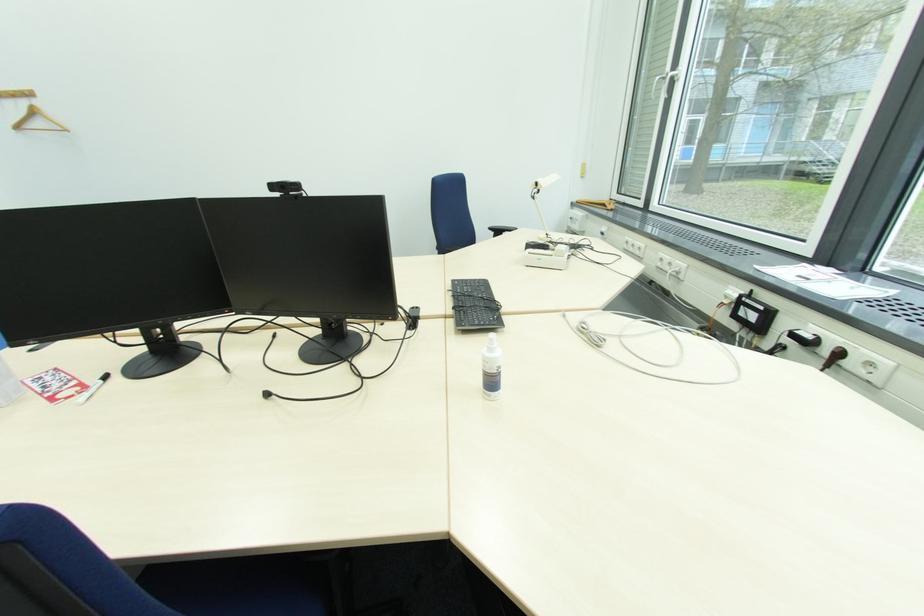
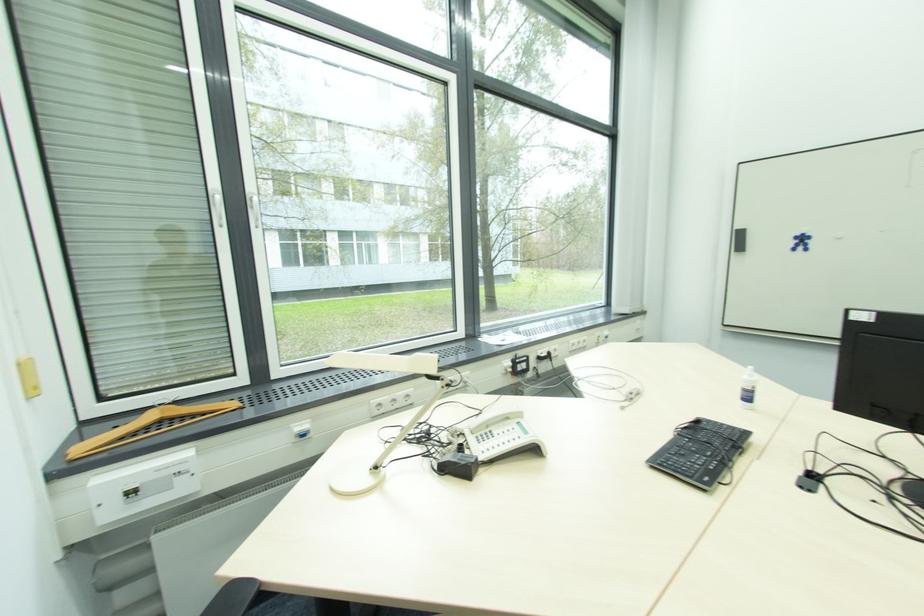
Find the pixel in the second image that matches pixel 622 205 in the first image.

(179, 406)